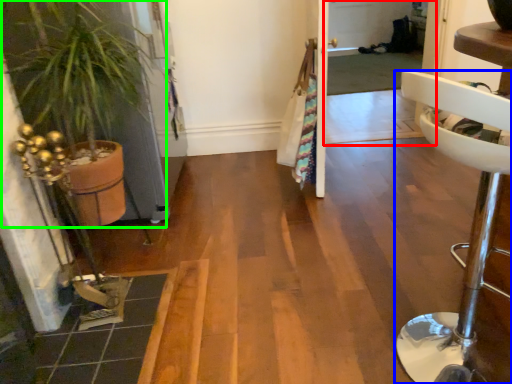
Question: Which object is the closest to the screen door (highlighted by a red box)? Choose among these: furniture (highlighted by a blue box) or houseplant (highlighted by a green box).

Choices:
 (A) furniture
 (B) houseplant

Answer: (B)